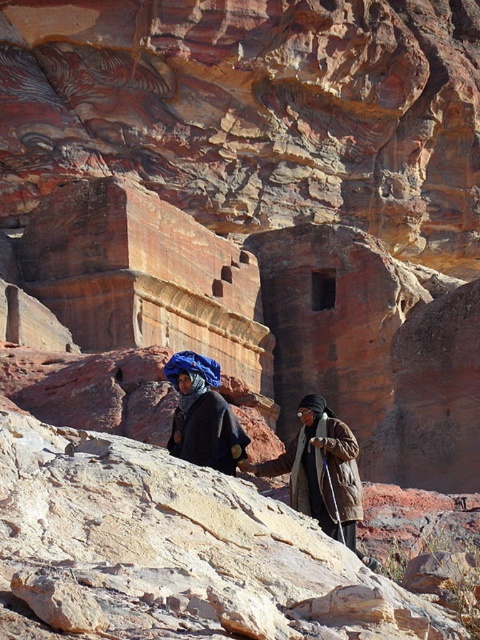
Question: Can you confirm if smooth beige rock at center is positioned above dark blue woolen robe at center?

Choices:
 (A) no
 (B) yes

Answer: (A)

Question: Among these objects, which one is nearest to the camera?

Choices:
 (A) dark blue woolen robe at center
 (B) smooth beige rock at center
 (C) brown textured coat at center

Answer: (B)

Question: Which point is farther to the camera?

Choices:
 (A) dark blue woolen robe at center
 (B) smooth beige rock at center

Answer: (A)

Question: Which object is farther from the camera taking this photo?

Choices:
 (A) dark blue woolen robe at center
 (B) smooth beige rock at center
 (C) brown textured coat at center

Answer: (A)

Question: Is brown textured coat at center behind dark blue woolen robe at center?

Choices:
 (A) yes
 (B) no

Answer: (B)

Question: Is smooth beige rock at center to the left of brown textured coat at center from the viewer's perspective?

Choices:
 (A) yes
 (B) no

Answer: (A)